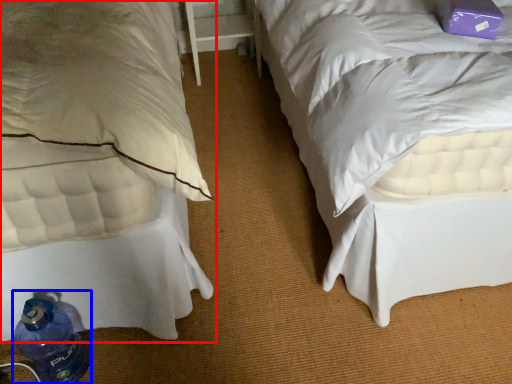
Question: Which object is further to the camera taking this photo, bed (highlighted by a red box) or bottle (highlighted by a blue box)?

Choices:
 (A) bed
 (B) bottle

Answer: (B)